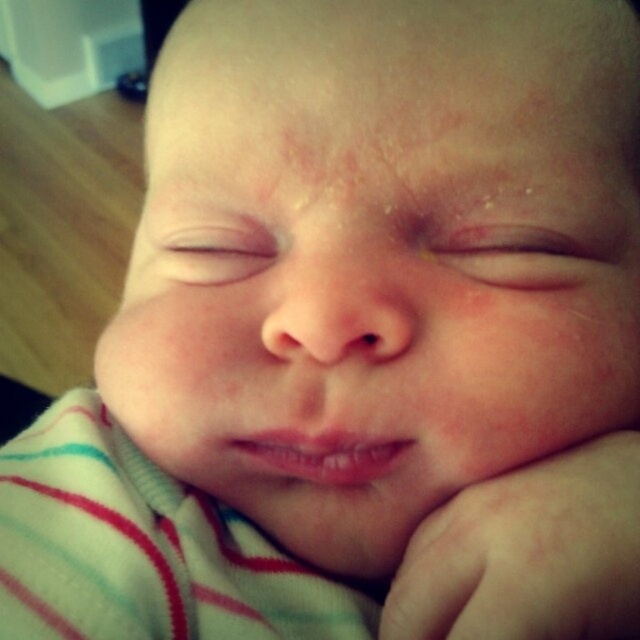
You are a nurse checking the baby for skin conditions. You notice a spot at point (x=529, y=554). What is the texture of the skin at that location?

The skin at point (x=529, y=554) is smooth, as it is part of the smooth skin hand at lower right.

From the picture: You are a nurse checking the baby in the image. You notice the smooth skin hand at lower right and the dry skin at center. Which area should you pay more attention to for potential skin issues?

The dry skin at center requires more attention as it is larger in size compared to the smooth skin hand at lower right, indicating a possible area of concern.